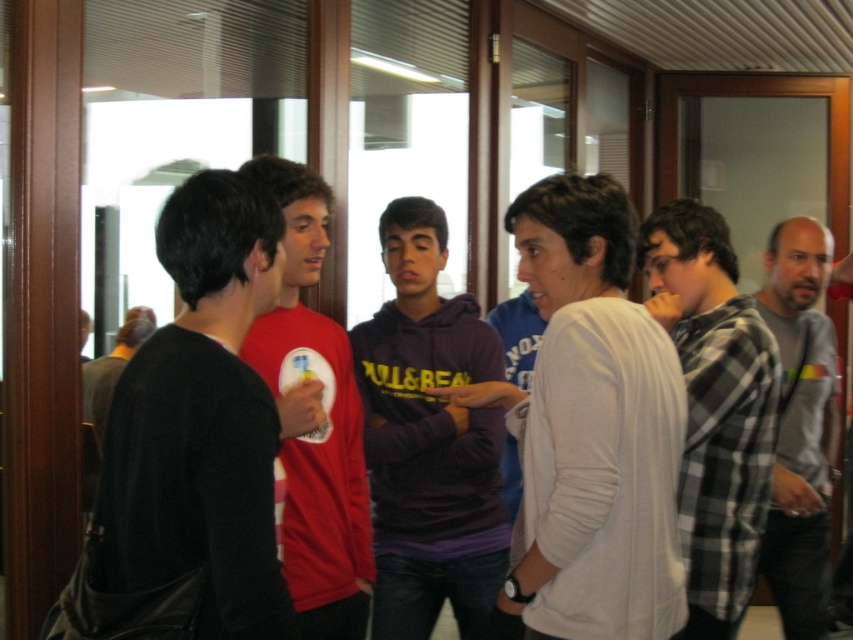
Is point (605, 538) more distant than point (405, 368)?

No, (605, 538) is in front of (405, 368).

Which of these two, white cotton sweater at center or purple fleece at center, stands shorter?

white cotton sweater at center

This screenshot has width=853, height=640. In order to click on white cotton sweater at center in this screenshot , I will do `click(595, 426)`.

Locate an element on the screen. This screenshot has width=853, height=640. red matte shirt at center is located at coordinates (314, 420).

Which is behind, point (297, 502) or point (781, 429)?

The point (781, 429) is behind.

Which is in front, point (354, 500) or point (790, 321)?

Point (354, 500) is more forward.

Find the location of a particular element. red matte shirt at center is located at coordinates (314, 420).

Who is more distant from viewer, [677,458] or [759,499]?

Positioned behind is point [759,499].

Which is in front, point (660, 440) or point (712, 376)?

Point (660, 440) is more forward.

Is point (544, 458) in front of point (718, 262)?

Yes, it is in front of point (718, 262).

In order to click on white cotton sweater at center in this screenshot , I will do `click(595, 426)`.